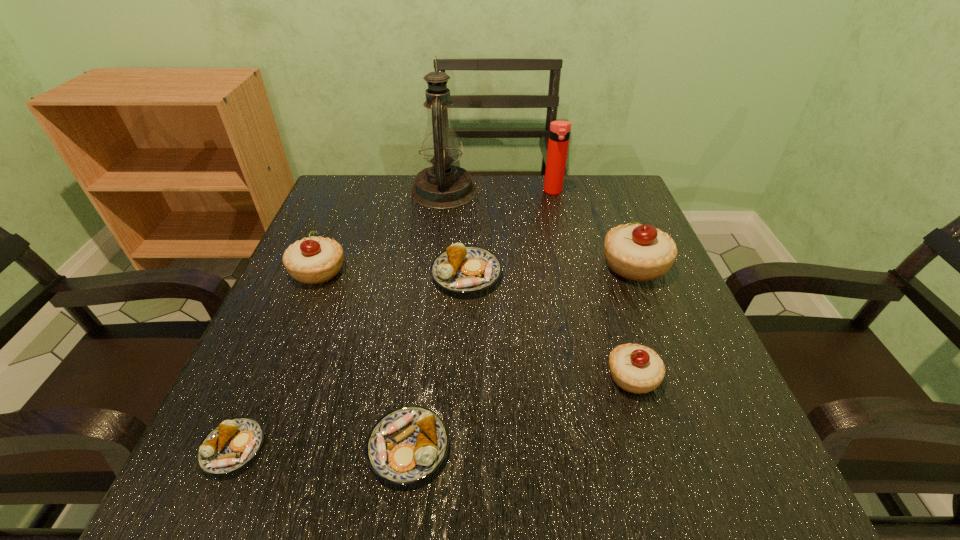
Identify the location of object that ranks as the closest to the second tallest object. (442, 186).

You are a GUI agent. You are given a task and a screenshot of the screen. Output one action in this format:
    pyautogui.click(x=<x>, y=<y>)
    Task: Click on the pastry that stands as the fifth closest to the nearest beige pastry
    The image size is (960, 540).
    Given the screenshot: What is the action you would take?
    pyautogui.click(x=234, y=443)

You are a GUI agent. You are given a task and a screenshot of the screen. Output one action in this format:
    pyautogui.click(x=<x>, y=<y>)
    Task: Click on the pastry that is the closest to the seventh tallest object
    
    Given the screenshot: What is the action you would take?
    pyautogui.click(x=234, y=443)

Find the location of a particular element. beige pastry that can be found as the second closest to the fourth tallest object is located at coordinates (635, 251).

Select which beige pastry appears as the closest to the fifth tallest pastry. Please provide its 2D coordinates. Your answer should be formatted as a tuple, i.e. [(x, y)], where the tuple contains the x and y coordinates of a point satisfying the conditions above.

[(635, 368)]

You are a GUI agent. You are given a task and a screenshot of the screen. Output one action in this format:
    pyautogui.click(x=<x>, y=<y>)
    Task: Click on the brown pastry that is the third closest one to the second smallest beige pastry
    
    Given the screenshot: What is the action you would take?
    pyautogui.click(x=407, y=445)

I want to click on the second closest brown pastry to the leftmost brown pastry, so click(x=461, y=269).

Locate an element on the screen. free location that satisfies the following two spatial constraints: 1. on the back side of the second shortest object; 2. on the left side of the second tallest object is located at coordinates (441, 192).

Where is `blank space that satisfies the following two spatial constraints: 1. on the front side of the oil lamp; 2. on the left side of the nearest beige pastry`? blank space that satisfies the following two spatial constraints: 1. on the front side of the oil lamp; 2. on the left side of the nearest beige pastry is located at coordinates (422, 376).

Identify the location of vacant point that satisfies the following two spatial constraints: 1. on the back side of the sixth farthest object; 2. on the left side of the tallest pastry. This screenshot has width=960, height=540. click(x=598, y=265).